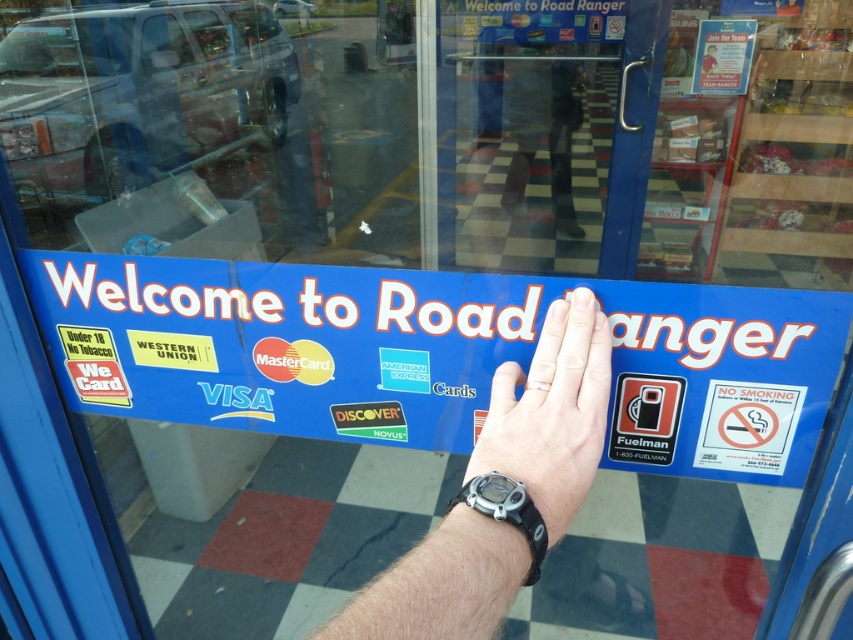
You are standing in front of the convenience store entrance. You see a point marked at coordinate (438, 355). What object is located at that point?

The point at coordinate (438, 355) marks the blue plastic sign at center.

You are at the entrance of Road Ranger convenience store and notice a blue plastic sign at center and a black rubber wristband at center. Which object is larger in size?

The blue plastic sign at center is bigger than the black rubber wristband at center.

You are standing outside the Road Ranger convenience store and want to know if the blue plastic sign at center is positioned higher than the black rubber watch at lower center. Can you determine this based on the reflection in the glass door?

The blue plastic sign at center is above the black rubber watch at lower center in the reflection, so yes, it is positioned higher.